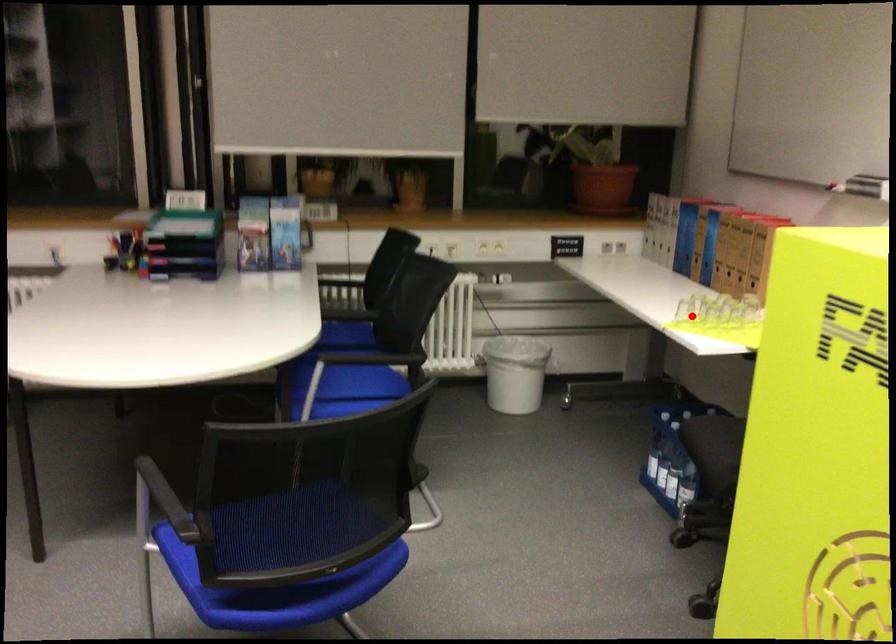
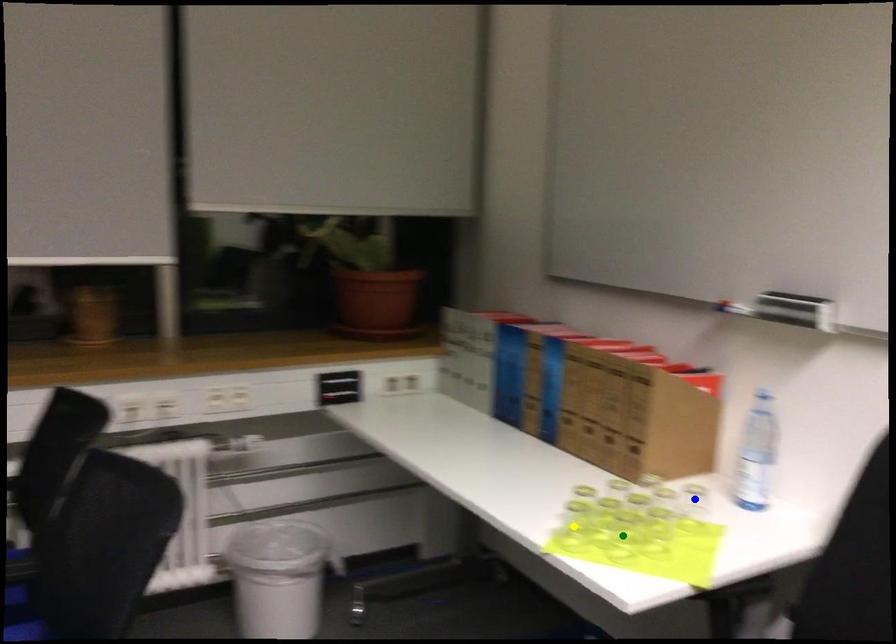
Question: I am providing you with two images of the same scene from different viewpoints. A red point is marked on the first image. You are given multiple points on the second image. In image 2, which mark is for the same physical point as the one in image 1?

Choices:
 (A) green point
 (B) blue point
 (C) yellow point

Answer: (C)